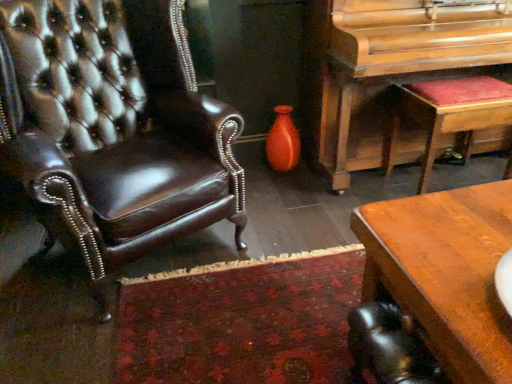
Where is `free space in front of brown leather chair at left`? This screenshot has height=384, width=512. free space in front of brown leather chair at left is located at coordinates (144, 340).